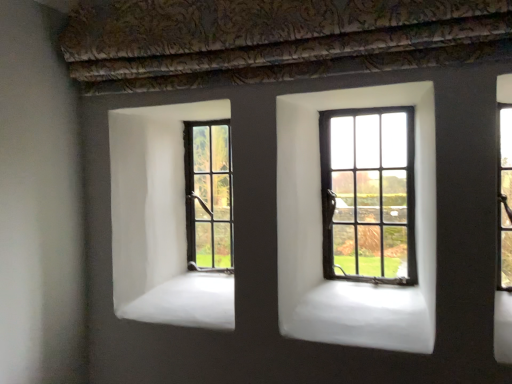
Question: Is dark brown wooden window at center, which ranks as the 2th window in back-to-front order, far from dark brown wooden window at center left, the 2th window from the right?

Choices:
 (A) no
 (B) yes

Answer: (A)

Question: Is dark brown wooden window at center, acting as the second window starting from the left, outside of dark brown wooden window at center left, the 1th window when ordered from back to front?

Choices:
 (A) yes
 (B) no

Answer: (A)

Question: Is dark brown wooden window at center, which ranks as the 2th window in back-to-front order, facing towards dark brown wooden window at center left, the 2th window from the right?

Choices:
 (A) yes
 (B) no

Answer: (B)

Question: Considering the relative sizes of dark brown wooden window at center, acting as the second window starting from the left, and dark brown wooden window at center left, the 2th window from the right, in the image provided, is dark brown wooden window at center, acting as the second window starting from the left, bigger than dark brown wooden window at center left, the 2th window from the right,?

Choices:
 (A) no
 (B) yes

Answer: (B)

Question: Is dark brown wooden window at center, marked as the 1th window in a right-to-left arrangement, in front of dark brown wooden window at center left, the 1th window when ordered from back to front?

Choices:
 (A) no
 (B) yes

Answer: (B)

Question: Does dark brown wooden window at center, which ranks as the 2th window in back-to-front order, have a greater height compared to dark brown wooden window at center left, the 2th window from the right?

Choices:
 (A) yes
 (B) no

Answer: (A)

Question: Can you confirm if dark brown wooden window at center left, the 2th window from the front, is smaller than dark brown wooden window at center, acting as the second window starting from the left?

Choices:
 (A) yes
 (B) no

Answer: (A)

Question: Is dark brown wooden window at center left, marked as the 1th window in a left-to-right arrangement, bigger than dark brown wooden window at center, acting as the second window starting from the left?

Choices:
 (A) no
 (B) yes

Answer: (A)

Question: Considering the relative sizes of dark brown wooden window at center left, the 2th window from the right, and dark brown wooden window at center, marked as the 1th window in a right-to-left arrangement, in the image provided, is dark brown wooden window at center left, the 2th window from the right, thinner than dark brown wooden window at center, marked as the 1th window in a right-to-left arrangement,?

Choices:
 (A) yes
 (B) no

Answer: (A)

Question: Is dark brown wooden window at center, acting as the second window starting from the left, surrounded by dark brown wooden window at center left, the 1th window when ordered from back to front?

Choices:
 (A) no
 (B) yes

Answer: (A)

Question: Is dark brown wooden window at center left, the 1th window when ordered from back to front, positioned far away from dark brown wooden window at center, which is counted as the 1th window, starting from the front?

Choices:
 (A) yes
 (B) no

Answer: (B)

Question: Is dark brown wooden window at center left, the 2th window from the right, placed right next to dark brown wooden window at center, marked as the 1th window in a right-to-left arrangement?

Choices:
 (A) yes
 (B) no

Answer: (B)

Question: In terms of size, does dark brown wooden window at center left, the 2th window from the front, appear bigger or smaller than dark brown wooden window at center, which is counted as the 1th window, starting from the front?

Choices:
 (A) small
 (B) big

Answer: (A)